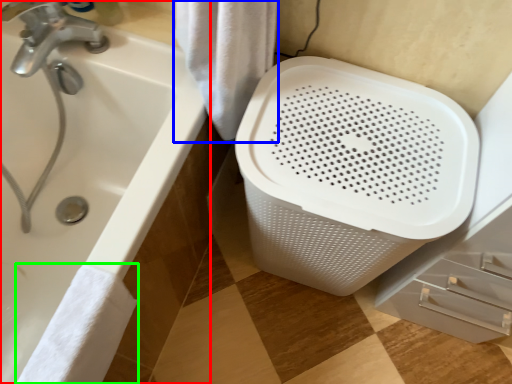
Question: Based on their relative distances, which object is nearer to bathtub (highlighted by a red box)? Choose from bath towel (highlighted by a blue box) and bath towel (highlighted by a green box).

Choices:
 (A) bath towel
 (B) bath towel

Answer: (B)